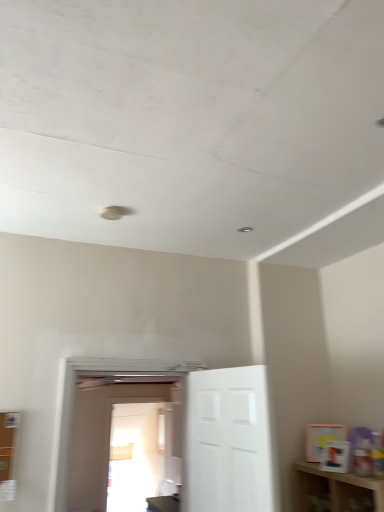
Question: Considering the positions of point (130, 468) and point (165, 393), is point (130, 468) closer or farther from the camera than point (165, 393)?

Choices:
 (A) farther
 (B) closer

Answer: (B)

Question: From the image's perspective, is transparent glass door at center located above or below white glossy door at center, arranged as the second door when viewed from the right?

Choices:
 (A) above
 (B) below

Answer: (B)

Question: Estimate the real-world distances between objects in this image. Which object is closer to the transparent glass door at center?

Choices:
 (A) white matte door at center, the 1th door in the right-to-left sequence
 (B) white glossy door at center, arranged as the second door when viewed from the right

Answer: (B)

Question: Which is farther from the white glossy door at center, the first door viewed from the left?

Choices:
 (A) white matte door at center, positioned as the second door in left-to-right order
 (B) transparent glass door at center

Answer: (A)